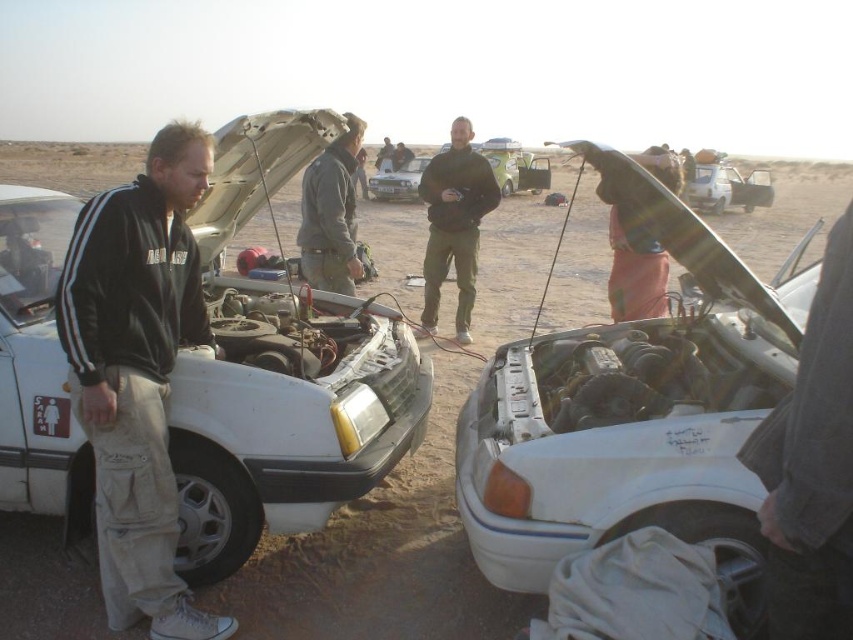
You are a mechanic inspecting two cars in a desert. The white matte car at left and the white matte car at center both have their hoods open. Which car has a taller engine compartment?

The white matte car at left has a greater height compared to the white matte car at center, so its engine compartment is taller.

You are standing in the desert and see the white matte car at left and the black cotton jacket at left. Which object is positioned higher in the scene?

The white matte car at left is located above the black cotton jacket at left, so it is positioned higher in the scene.